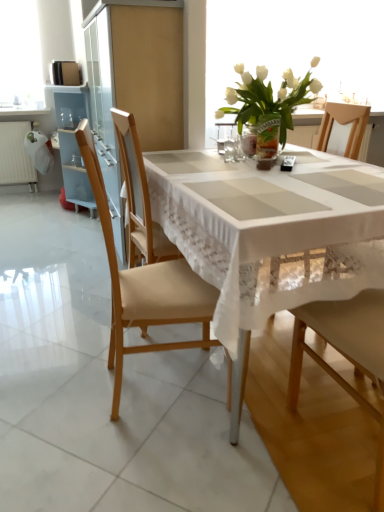
Locate an element on the screen. The image size is (384, 512). free spot behind translucent glass vase at center, which is counted as the 1th tableware, starting from the left is located at coordinates (222, 154).